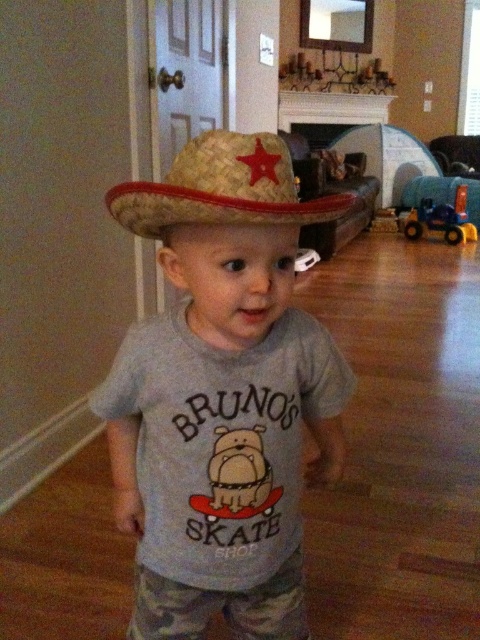
Where is `straw hat at center`? straw hat at center is located at coordinates (220, 394).

Where is `straw hat at center`? The image size is (480, 640). straw hat at center is located at coordinates 220,394.